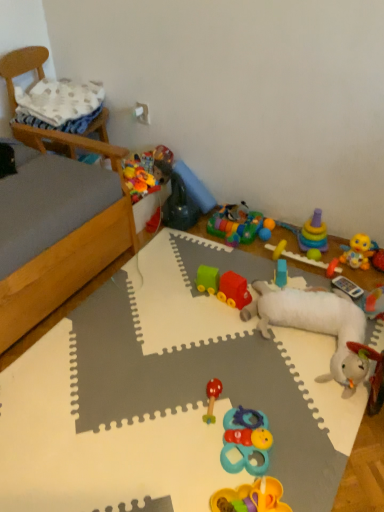
The height and width of the screenshot is (512, 384). I want to click on free space to the back side of blue rubber teething ring at center, positioned as the first toy in bottom-to-top order, so click(249, 386).